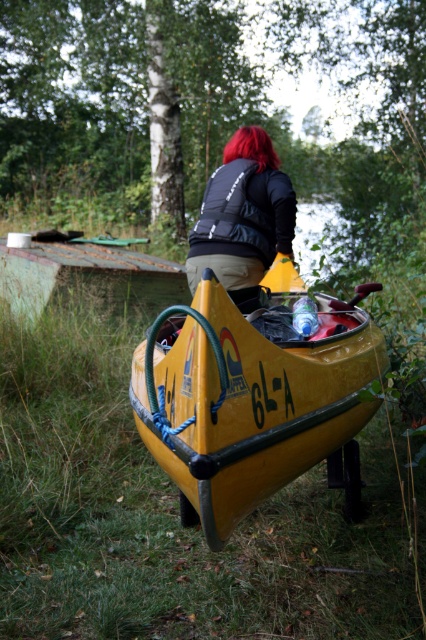
Does yellow matte boat at center have a lesser height compared to red hair at upper center?

No, yellow matte boat at center is not shorter than red hair at upper center.

What are the coordinates of `yellow matte boat at center` in the screenshot? It's located at (253, 400).

Can you confirm if yellow matte boat at center is bigger than black matte vest at center?

Yes, yellow matte boat at center is bigger than black matte vest at center.

Who is more distant from viewer, (264, 490) or (222, 196)?

Positioned behind is point (222, 196).

Locate an element on the screen. The height and width of the screenshot is (640, 426). yellow matte boat at center is located at coordinates (253, 400).

Describe the element at coordinates (242, 212) in the screenshot. This screenshot has width=426, height=640. I see `black matte vest at center` at that location.

Consider the image. Who is positioned more to the right, black matte vest at center or red hair at upper center?

black matte vest at center

Which is behind, point (255, 168) or point (244, 145)?

The point (244, 145) is more distant.

The image size is (426, 640). In order to click on black matte vest at center in this screenshot , I will do `click(242, 212)`.